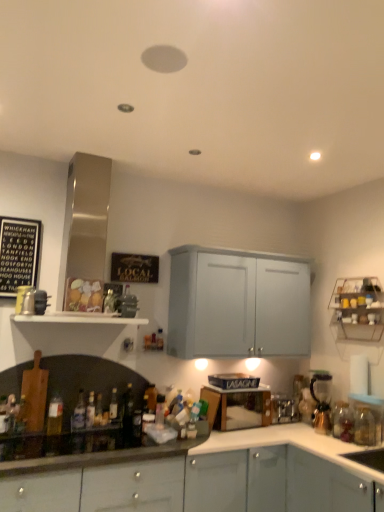
The image size is (384, 512). Identify the location of free space in front of metallic stainless steel toaster oven at lower center, the first appliance in the back-to-front sequence. (293, 431).